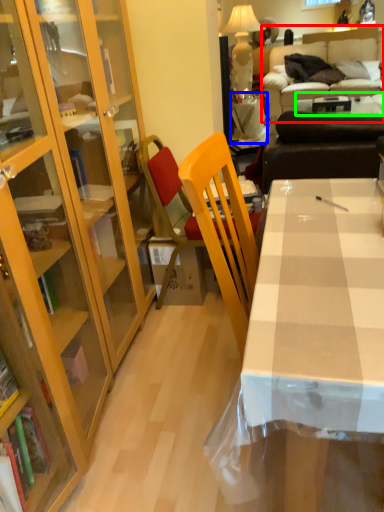
Question: Considering the real-world distances, which object is closest to studio couch (highlighted by a red box)? table (highlighted by a blue box) or table (highlighted by a green box).

Choices:
 (A) table
 (B) table

Answer: (B)